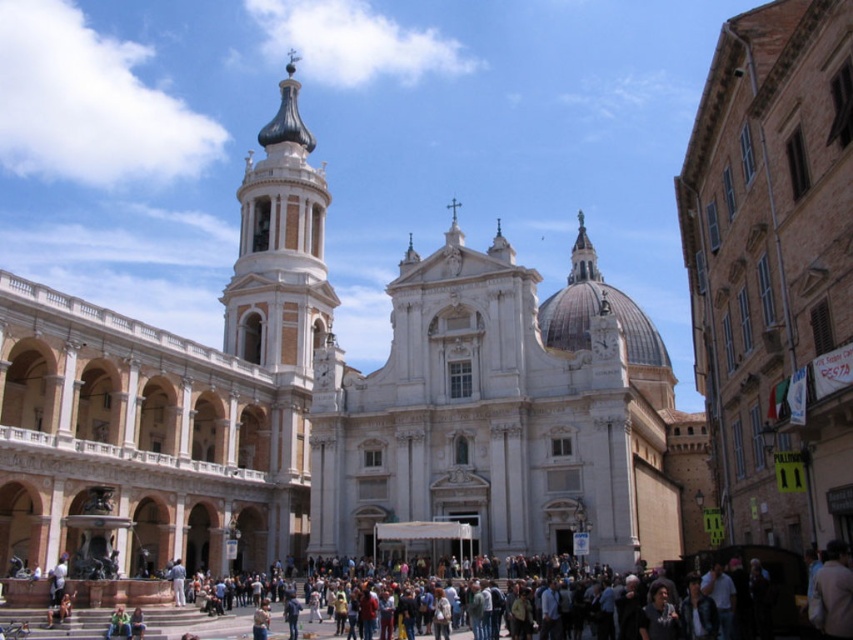
Is white stone church at center taller than white marble bell tower at upper left?

Correct, white stone church at center is much taller as white marble bell tower at upper left.

Is white stone church at center below white marble bell tower at upper left?

Correct, white stone church at center is located below white marble bell tower at upper left.

The image size is (853, 640). In order to click on white stone church at center in this screenshot , I will do `click(347, 408)`.